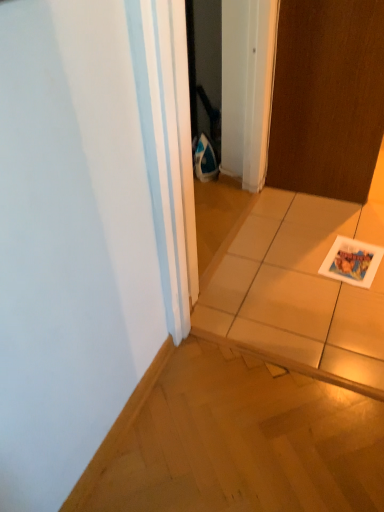
Locate an element on the screen. free location above white glossy tile at center (from a real-world perspective) is located at coordinates 310,250.